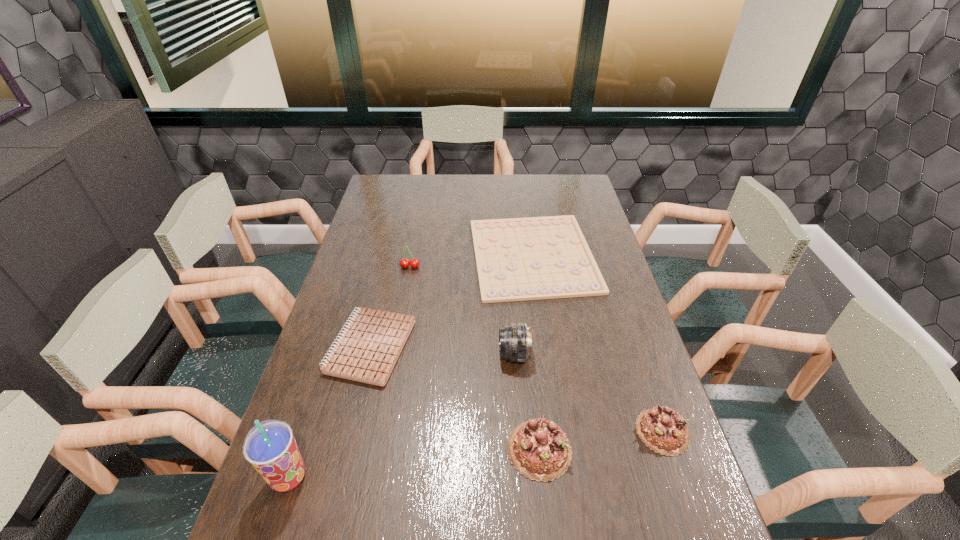
The height and width of the screenshot is (540, 960). Find the location of `vacant space located on the back of the third shortest object`. vacant space located on the back of the third shortest object is located at coordinates (644, 379).

What are the coordinates of `free space located with the stems of the cherry pointing upwards` in the screenshot? It's located at (401, 316).

I want to click on vacant space located on the left of the shortest object, so click(374, 255).

At what (x,y) coordinates should I click in order to perform the action: click on vacant space located on the back of the sixth tallest object. Please return your answer as a coordinate pair (x, y). This screenshot has width=960, height=540. Looking at the image, I should click on (382, 294).

Locate an element on the screen. This screenshot has width=960, height=540. free space located 0.340m at the front element of the telephoto lens is located at coordinates (377, 355).

The width and height of the screenshot is (960, 540). What are the coordinates of `free space located 0.340m at the front element of the telephoto lens` in the screenshot? It's located at (377, 355).

You are a GUI agent. You are given a task and a screenshot of the screen. Output one action in this format:
    pyautogui.click(x=<x>, y=<y>)
    Task: Click on the free space located at the front element of the telephoto lens
    The image size is (960, 540).
    Given the screenshot: What is the action you would take?
    pyautogui.click(x=428, y=355)

Locate an element on the screen. free space located on the right of the smoothie is located at coordinates (342, 477).

This screenshot has width=960, height=540. Find the location of `object located in the near edge section of the desktop`. object located in the near edge section of the desktop is located at coordinates (270, 447).

You are a GUI agent. You are given a task and a screenshot of the screen. Output one action in this format:
    pyautogui.click(x=<x>, y=<y>)
    Task: Click on the notebook at the left edge
    This screenshot has height=540, width=960.
    Given the screenshot: What is the action you would take?
    pos(369,347)